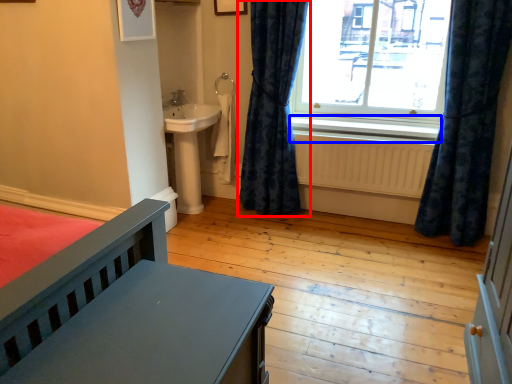
Question: Which object is closer to the camera taking this photo, curtain (highlighted by a red box) or window sill (highlighted by a blue box)?

Choices:
 (A) curtain
 (B) window sill

Answer: (A)